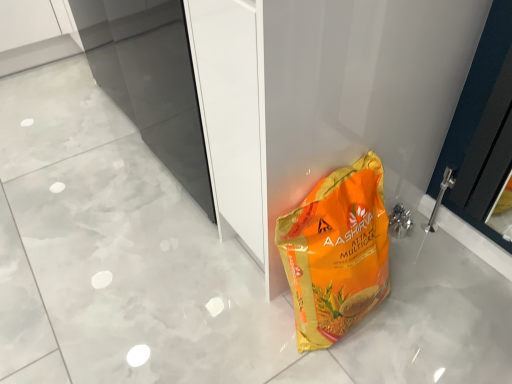
Question: Should I look upward or downward to see orange matte plastic bag at lower right?

Choices:
 (A) up
 (B) down

Answer: (B)